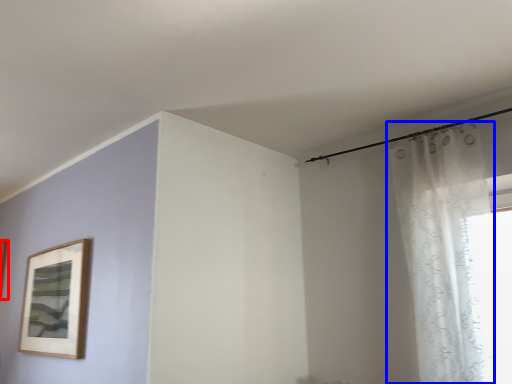
Question: Which of the following is the farthest to the observer, picture frame (highlighted by a red box) or curtain (highlighted by a blue box)?

Choices:
 (A) picture frame
 (B) curtain

Answer: (A)